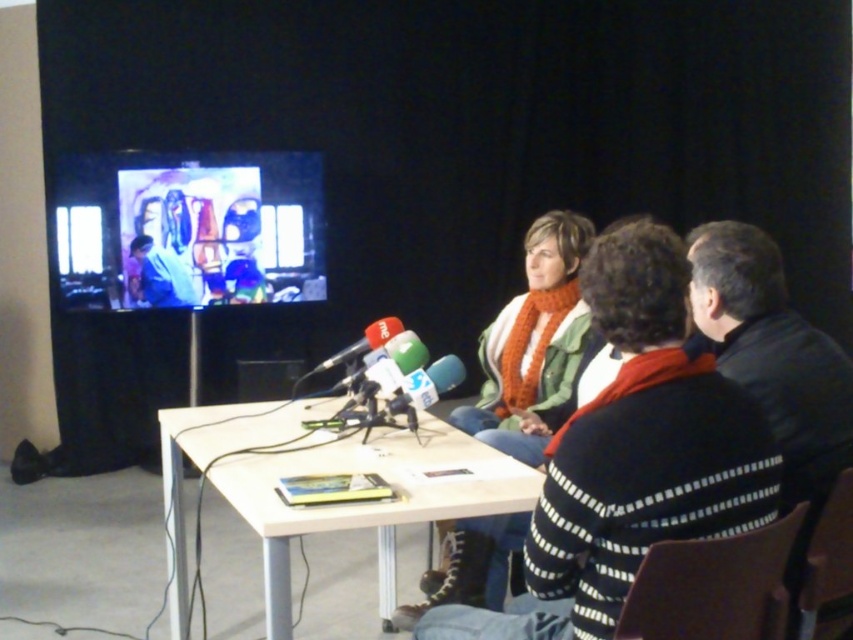
Question: Which object appears closest to the camera in this image?

Choices:
 (A) smooth blue shirt at center
 (B) white plastic table at center

Answer: (B)

Question: Which object is the farthest from the smooth blue shirt at center?

Choices:
 (A) white plastic table at center
 (B) knitted orange scarf at center

Answer: (B)

Question: Can you confirm if white plastic table at center is positioned to the left of smooth blue shirt at center?

Choices:
 (A) no
 (B) yes

Answer: (A)

Question: Is white plastic table at center closer to camera compared to smooth blue shirt at center?

Choices:
 (A) no
 (B) yes

Answer: (B)

Question: Which object is the closest to the white plastic table at center?

Choices:
 (A) smooth blue shirt at center
 (B) knitted orange scarf at center

Answer: (B)

Question: Can you confirm if knitted orange scarf at center is smaller than smooth blue shirt at center?

Choices:
 (A) yes
 (B) no

Answer: (B)